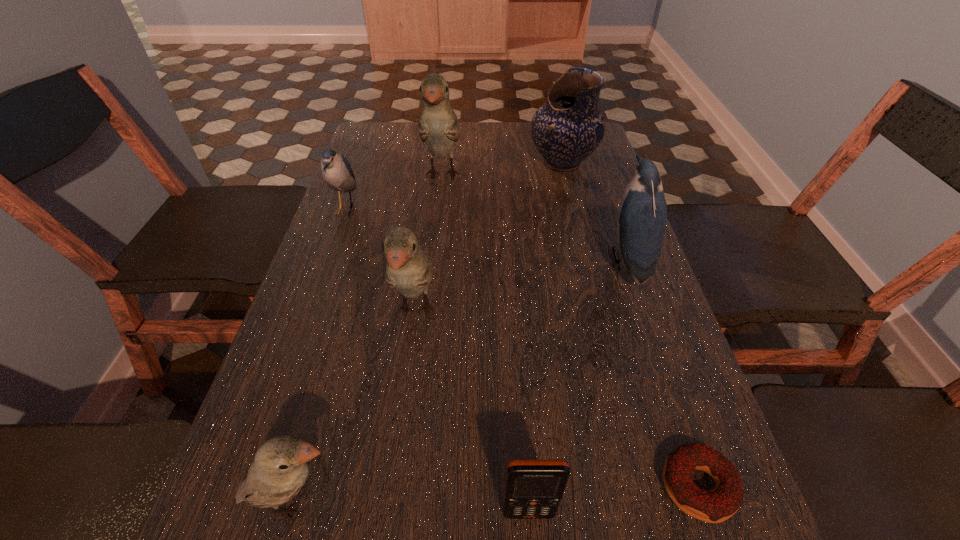
The width and height of the screenshot is (960, 540). Find the location of `free space that satisfies the following two spatial constraints: 1. at the face of the tallest bird; 2. at the tip of the left blue bird's beak`. free space that satisfies the following two spatial constraints: 1. at the face of the tallest bird; 2. at the tip of the left blue bird's beak is located at coordinates (438, 209).